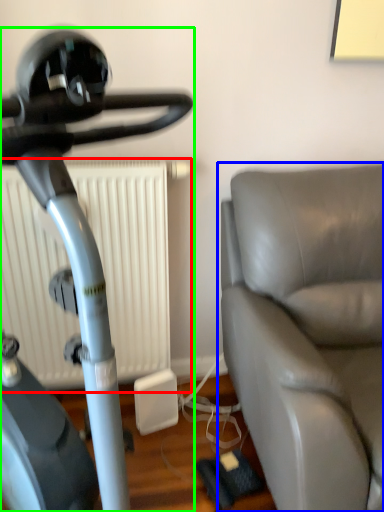
Question: Based on their relative distances, which object is nearer to radiator (highlighted by a red box)? Choose from studio couch (highlighted by a blue box) and stationary bicycle (highlighted by a green box).

Choices:
 (A) studio couch
 (B) stationary bicycle

Answer: (A)